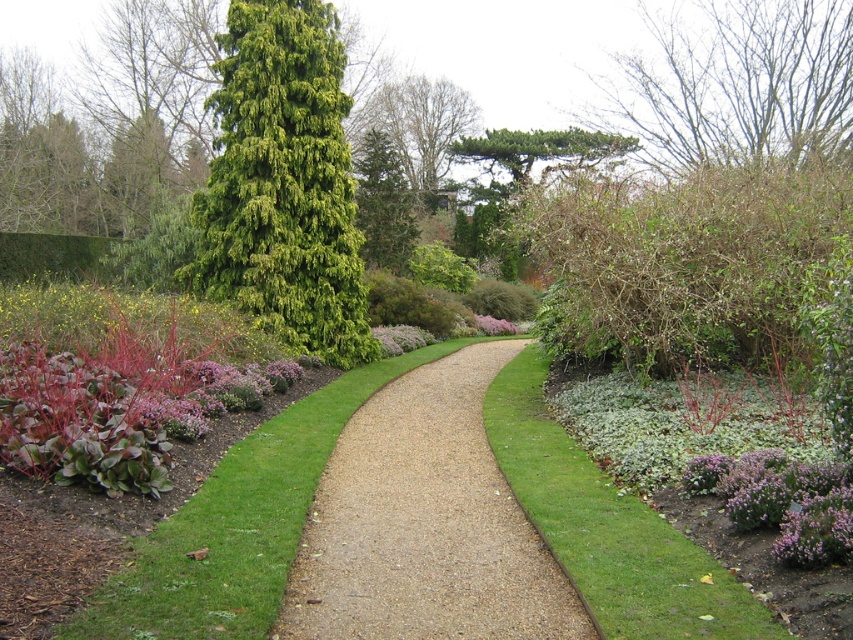
You are a gardener who needs to water both the green textured evergreen tree at center and the purple fluffy flower at center. Your watering can has a range of 6 meters. Can you water both plants from your current position without moving?

The green textured evergreen tree at center and the purple fluffy flower at center are 6.18 meters apart from each other. Since your watering can only reaches 6 meters, you cannot water both plants from your current position without moving.

You are standing at the starting point of the garden pathway and want to reach the end of the path. Which of the two points, point (x=84, y=627) or point (x=509, y=460), would you encounter first along your path?

Point (x=84, y=627) is in front of point (x=509, y=460), so you would encounter point (x=84, y=627) first along the path.